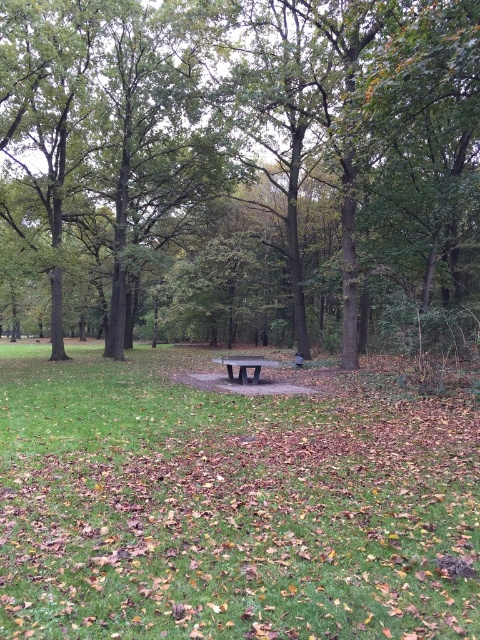
Does brown wood bench at center appear under dark gray polished bench at center?

Incorrect, brown wood bench at center is not positioned below dark gray polished bench at center.

Who is lower down, brown wood bench at center or dark gray polished bench at center?

Answer: Positioned lower is dark gray polished bench at center.

Is point (475, 19) less distant than point (248, 356)?

Yes, point (475, 19) is closer to viewer.

The height and width of the screenshot is (640, 480). What are the coordinates of `brown wood bench at center` in the screenshot? It's located at (240, 170).

Between brown wood bench at center and wooden bench at center, which one has more height?

brown wood bench at center is taller.

Who is shorter, brown wood bench at center or wooden bench at center?

wooden bench at center

Is point (145, 122) more distant than point (0, 358)?

No, (145, 122) is in front of (0, 358).

At what (x,y) coordinates should I click in order to perform the action: click on brown wood bench at center. Please return your answer as a coordinate pair (x, y). The width and height of the screenshot is (480, 640). Looking at the image, I should click on (240, 170).

Does wooden bench at center have a smaller size compared to dark gray polished bench at center?

No.

Between point (211, 541) and point (251, 360), which one is positioned behind?

Point (251, 360)

Who is more distant from viewer, (266, 616) or (257, 380)?

The point (257, 380) is behind.

At what (x,y) coordinates should I click in order to perform the action: click on wooden bench at center. Please return your answer as a coordinate pair (x, y). The width and height of the screenshot is (480, 640). Looking at the image, I should click on (228, 508).